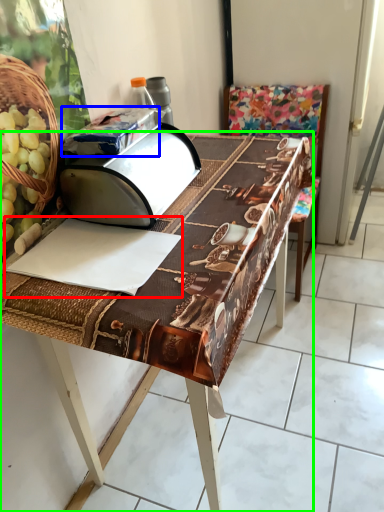
Question: Which is farther away from wrapping paper (highlighted by a red box)? wrapping paper (highlighted by a blue box) or table (highlighted by a green box)?

Choices:
 (A) wrapping paper
 (B) table

Answer: (A)